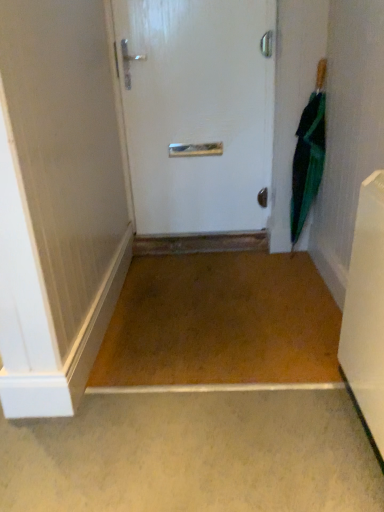
What is the approximate width of white plastic radiator at lower right?

white plastic radiator at lower right is 6.30 inches in width.

In order to click on green matte umbrella at right in this screenshot , I will do `click(308, 156)`.

From the image's perspective, is green matte umbrella at right located above white plastic radiator at lower right?

Yes, from the image's perspective, green matte umbrella at right is on top of white plastic radiator at lower right.

Is green matte umbrella at right not near white plastic radiator at lower right?

green matte umbrella at right is positioned a significant distance from white plastic radiator at lower right.

Is green matte umbrella at right spatially inside white plastic radiator at lower right, or outside of it?

green matte umbrella at right cannot be found inside white plastic radiator at lower right.

Based on the photo, from a real-world perspective, who is located higher, green matte umbrella at right or white plastic radiator at lower right?

In real-world perspective, green matte umbrella at right is above.

Consider the image. How different are the orientations of white glossy door at center and green matte umbrella at right in degrees?

They differ by 32.2 degrees in their facing directions.

Does white glossy door at center lie in front of green matte umbrella at right?

That is False.

At what (x,y) coordinates should I click in order to perform the action: click on umbrella in front of the white glossy door at center. Please return your answer as a coordinate pair (x, y). Looking at the image, I should click on (308, 156).

Between white glossy door at center and green matte umbrella at right, which one has more height?

Standing taller between the two is white glossy door at center.

How many degrees apart are the facing directions of white glossy door at center and white plastic radiator at lower right?

The facing directions of white glossy door at center and white plastic radiator at lower right are 91.7 degrees apart.

From the image's perspective, relative to white plastic radiator at lower right, is white glossy door at center above or below?

Clearly, from the image's perspective, white glossy door at center is above white plastic radiator at lower right.

In terms of height, does white glossy door at center look taller or shorter compared to white plastic radiator at lower right?

white glossy door at center is taller than white plastic radiator at lower right.

Is white glossy door at center oriented away from white plastic radiator at lower right?

white glossy door at center is not turned away from white plastic radiator at lower right.

Is white plastic radiator at lower right aimed at white glossy door at center?

No, white plastic radiator at lower right is not facing towards white glossy door at center.

From the image's perspective, is white plastic radiator at lower right located above or below white glossy door at center?

From the image's perspective, white plastic radiator at lower right appears below white glossy door at center.

Is white plastic radiator at lower right to the left or to the right of white glossy door at center in the image?

white plastic radiator at lower right is to the right of white glossy door at center.

Between point (318, 170) and point (125, 38), which one is positioned behind?

The point (318, 170) is farther.

Is green matte umbrella at right turned away from white glossy door at center?

No, green matte umbrella at right is not facing the opposite direction of white glossy door at center.

From a real-world perspective, is green matte umbrella at right positioned over white glossy door at center based on gravity?

Actually, green matte umbrella at right is physically below white glossy door at center in the real world.

Considering the sizes of objects white plastic radiator at lower right and green matte umbrella at right in the image provided, who is taller, white plastic radiator at lower right or green matte umbrella at right?

green matte umbrella at right is taller.

Is point (345, 343) farther from viewer compared to point (292, 212)?

No, (345, 343) is in front of (292, 212).

From a real-world perspective, is white plastic radiator at lower right physically located above or below green matte umbrella at right?

In terms of real-world spatial position, white plastic radiator at lower right is below green matte umbrella at right.

Is green matte umbrella at right completely or partially inside white plastic radiator at lower right?

No.

Where is `appliance below the green matte umbrella at right (from a real-world perspective)`? The image size is (384, 512). appliance below the green matte umbrella at right (from a real-world perspective) is located at coordinates (366, 310).

In order to click on door on the left of green matte umbrella at right in this screenshot , I will do `click(198, 112)`.

Based on their spatial positions, is green matte umbrella at right or white glossy door at center closer to white plastic radiator at lower right?

Based on the image, green matte umbrella at right appears to be nearer to white plastic radiator at lower right.

When comparing their distances from white plastic radiator at lower right, does white glossy door at center or green matte umbrella at right seem further?

white glossy door at center lies further to white plastic radiator at lower right than the other object.

Based on the photo, estimate the real-world distances between objects in this image. Which object is further from green matte umbrella at right, white glossy door at center or white plastic radiator at lower right?

Based on the image, white plastic radiator at lower right appears to be further to green matte umbrella at right.

Based on their spatial positions, is white plastic radiator at lower right or white glossy door at center further from green matte umbrella at right?

white plastic radiator at lower right is further to green matte umbrella at right.

Based on their spatial positions, is green matte umbrella at right or white plastic radiator at lower right further from white glossy door at center?

white plastic radiator at lower right.

When comparing their distances from white glossy door at center, does white plastic radiator at lower right or green matte umbrella at right seem closer?

green matte umbrella at right is positioned closer to the anchor white glossy door at center.

Locate an element on the screen. umbrella between white plastic radiator at lower right and white glossy door at center in the front-back direction is located at coordinates (308, 156).